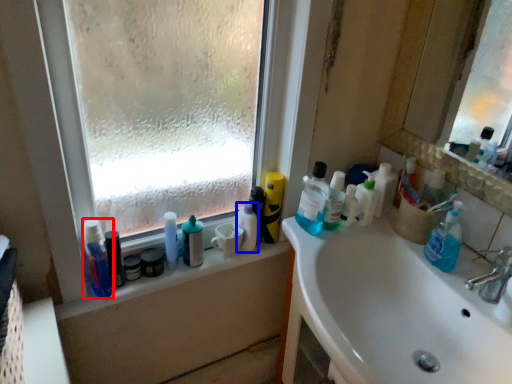
Question: Which object is closer to the camera taking this photo, toiletry (highlighted by a red box) or toiletry (highlighted by a blue box)?

Choices:
 (A) toiletry
 (B) toiletry

Answer: (A)